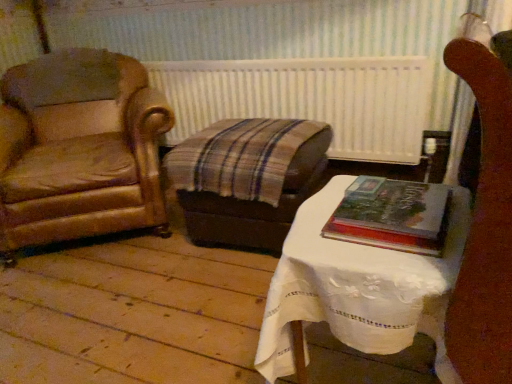
Question: From the image's perspective, is hardcover book at center right on white textured radiator at center?

Choices:
 (A) yes
 (B) no

Answer: (B)

Question: Is hardcover book at center right bigger than white textured radiator at center?

Choices:
 (A) no
 (B) yes

Answer: (A)

Question: Are hardcover book at center right and white textured radiator at center far apart?

Choices:
 (A) no
 (B) yes

Answer: (B)

Question: Considering the relative sizes of hardcover book at center right and white textured radiator at center in the image provided, is hardcover book at center right taller than white textured radiator at center?

Choices:
 (A) no
 (B) yes

Answer: (A)

Question: Is hardcover book at center right outside of white textured radiator at center?

Choices:
 (A) yes
 (B) no

Answer: (A)

Question: Is white lace-covered table at center in front of or behind hardcover book at center right in the image?

Choices:
 (A) behind
 (B) front

Answer: (B)

Question: Looking at the image, does white lace-covered table at center seem bigger or smaller compared to hardcover book at center right?

Choices:
 (A) big
 (B) small

Answer: (A)

Question: Is white lace-covered table at center wider or thinner than hardcover book at center right?

Choices:
 (A) wide
 (B) thin

Answer: (A)

Question: Is point (276, 296) closer or farther from the camera than point (394, 195)?

Choices:
 (A) farther
 (B) closer

Answer: (B)

Question: Is hardcover book at center right spatially inside white textured radiator at center, or outside of it?

Choices:
 (A) inside
 (B) outside

Answer: (B)

Question: Is hardcover book at center right wider or thinner than white textured radiator at center?

Choices:
 (A) wide
 (B) thin

Answer: (A)

Question: From a real-world perspective, is hardcover book at center right positioned above or below white textured radiator at center?

Choices:
 (A) below
 (B) above

Answer: (B)

Question: Does point (333, 218) appear closer or farther from the camera than point (362, 107)?

Choices:
 (A) farther
 (B) closer

Answer: (B)

Question: Considering the positions of point (330, 306) and point (328, 59), is point (330, 306) closer or farther from the camera than point (328, 59)?

Choices:
 (A) farther
 (B) closer

Answer: (B)

Question: Looking at the image, does white lace-covered table at center seem bigger or smaller compared to white textured radiator at center?

Choices:
 (A) big
 (B) small

Answer: (A)